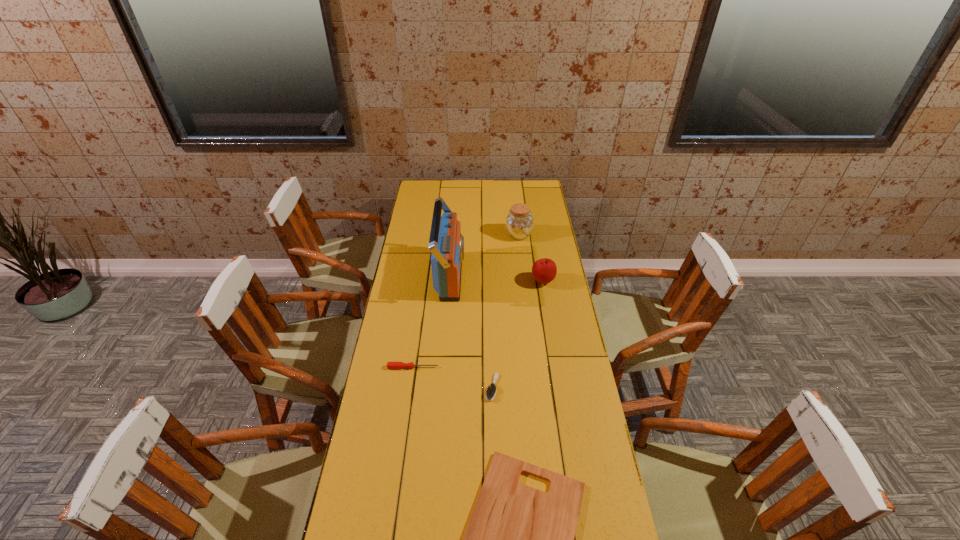
The image size is (960, 540). I want to click on vacant space that is in between the screwdriver and the apple, so click(478, 325).

At what (x,y) coordinates should I click in order to perform the action: click on vacant point located between the screwdriver and the fifth farthest object. Please return your answer as a coordinate pair (x, y). This screenshot has height=540, width=960. Looking at the image, I should click on (452, 377).

Locate an element on the screen. The height and width of the screenshot is (540, 960). vacant area between the fourth farthest object and the second tallest object is located at coordinates (466, 301).

Locate an element on the screen. free space between the scrubbing brush and the third nearest object is located at coordinates (452, 377).

The width and height of the screenshot is (960, 540). What are the coordinates of `free space between the fourth shortest object and the fifth farthest object` in the screenshot? It's located at pos(517,334).

Find the location of a particular element. The image size is (960, 540). free space between the apple and the jar is located at coordinates (531, 258).

Find the location of a particular element. This screenshot has height=540, width=960. the third closest object to the fifth shortest object is located at coordinates (491, 391).

Point out which object is positioned as the fifth nearest to the second tallest object. Please provide its 2D coordinates. Your answer should be formatted as a tuple, i.e. [(x, y)], where the tuple contains the x and y coordinates of a point satisfying the conditions above.

[(519, 539)]

Locate an element on the screen. free space that satisfies the following two spatial constraints: 1. on the front-facing side of the radio receiver; 2. on the left side of the apple is located at coordinates (449, 281).

Locate an element on the screen. This screenshot has height=540, width=960. blank space that satisfies the following two spatial constraints: 1. on the front-facing side of the scrubbing brush; 2. on the right side of the radio receiver is located at coordinates (442, 387).